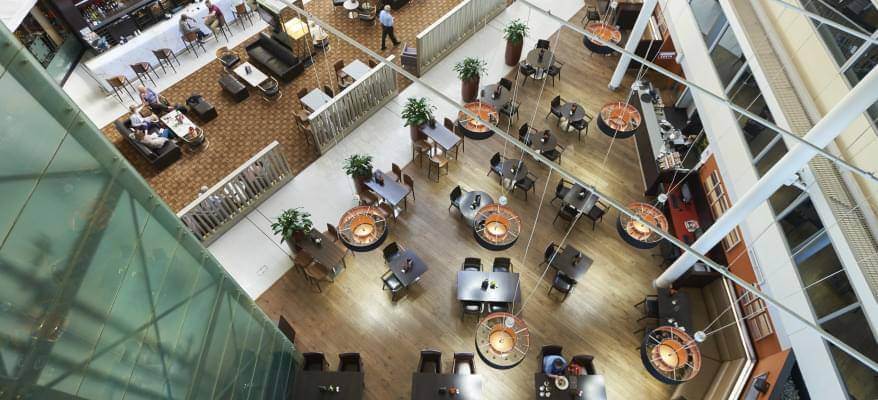
This screenshot has width=878, height=400. What are the coordinates of `windowpanes` in the screenshot? It's located at (853, 333), (821, 260), (766, 160), (753, 136), (722, 52), (709, 12), (859, 13), (866, 61).